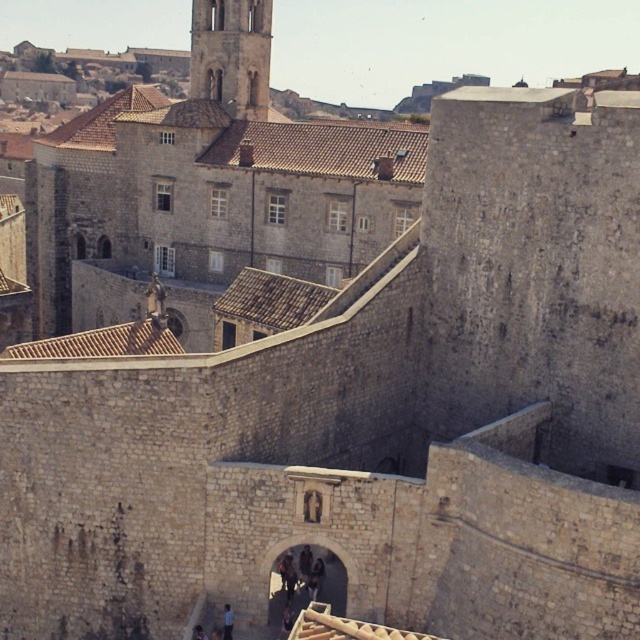
Question: Is light beige stone tower at upper center closer to the viewer compared to dark blue shirt at center?

Choices:
 (A) no
 (B) yes

Answer: (A)

Question: Is light beige stone tower at upper center bigger than dark blue shirt at center?

Choices:
 (A) yes
 (B) no

Answer: (A)

Question: Among these points, which one is farthest from the camera?

Choices:
 (A) (264, 45)
 (B) (227, 636)

Answer: (A)

Question: Is light beige stone tower at upper center behind dark blue shirt at center?

Choices:
 (A) no
 (B) yes

Answer: (B)

Question: Which point appears closest to the camera in this image?

Choices:
 (A) (230, 61)
 (B) (225, 632)

Answer: (B)

Question: Which of the following is the farthest from the observer?

Choices:
 (A) light beige stone tower at upper center
 (B) dark blue shirt at center

Answer: (A)